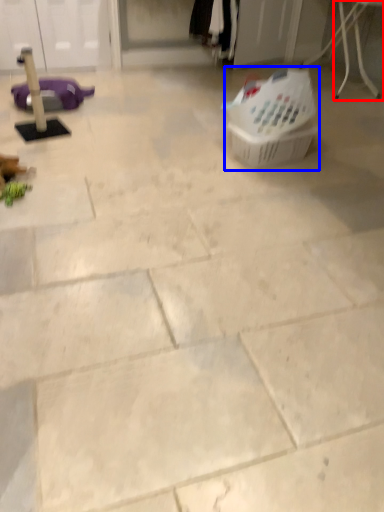
Question: Which of the following is the closest to the observer, furniture (highlighted by a red box) or basket (highlighted by a blue box)?

Choices:
 (A) furniture
 (B) basket

Answer: (B)